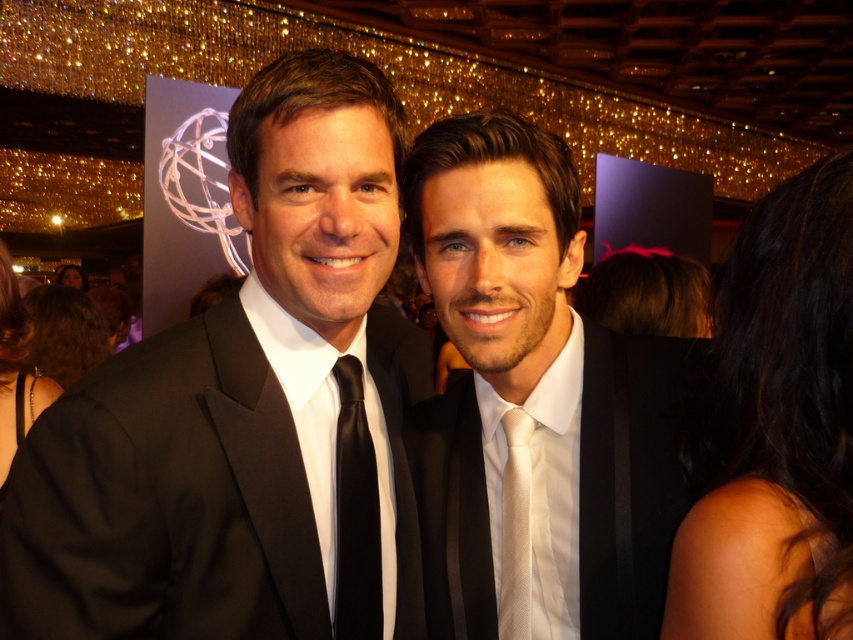
You are a photographer at a formal event. You need to adjust the lighting to ensure both the white satin tie at center and the black satin dress at lower left are visible. Which object should you focus on first to ensure proper exposure?

The white satin tie at center is in front of the black satin dress at lower left, so you should focus on the white satin tie at center first to ensure proper exposure.

You are a photographer at a formal event. You need to adjust the lighting to ensure both the white satin tie at center and the black satin dress at lower left are well lit. Which object is closer to the camera, and why?

The white satin tie at center is positioned over the black satin dress at lower left, meaning it is closer to the camera. This is because objects that appear in front of others in the image are typically closer to the viewer.

You are a photographer at a formal event. You need to adjust the lighting to ensure both the black satin tie at center and the curly brown hair at left are well lit. Which object should you focus on first if the shorter one requires more immediate attention?

The black satin tie at center is shorter than the curly brown hair at left, so you should focus on the black satin tie at center first since it requires more immediate attention.